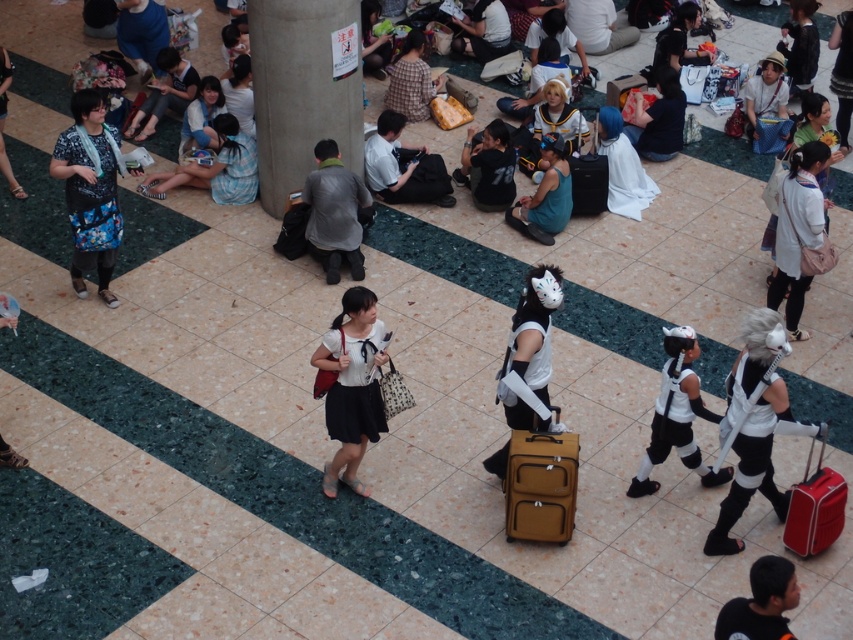
Is matte black bag at left to the left of light blue fabric dress at upper left from the viewer's perspective?

Indeed, matte black bag at left is positioned on the left side of light blue fabric dress at upper left.

Can you confirm if matte black bag at left is positioned to the right of light blue fabric dress at upper left?

In fact, matte black bag at left is to the left of light blue fabric dress at upper left.

Does point (64, 168) come farther from viewer compared to point (234, 99)?

No.

What are the coordinates of `matte black bag at left` in the screenshot? It's located at (90, 189).

Between light blue plaid dress at center and black matte shirt at center, which one appears on the right side from the viewer's perspective?

From the viewer's perspective, black matte shirt at center appears more on the right side.

Does light blue plaid dress at center appear under black matte shirt at center?

Yes, light blue plaid dress at center is below black matte shirt at center.

Where is `light blue plaid dress at center`? light blue plaid dress at center is located at coordinates (213, 168).

Identify the location of light blue plaid dress at center. Image resolution: width=853 pixels, height=640 pixels. (213, 168).

You are a GUI agent. You are given a task and a screenshot of the screen. Output one action in this format:
    pyautogui.click(x=<x>, y=<y>)
    Task: Click on the white matte shirt at center
    The height and width of the screenshot is (640, 853).
    Given the screenshot: What is the action you would take?
    pyautogui.click(x=403, y=166)

Between white matte shirt at center and white fabric bag at center, which one is positioned lower?

white matte shirt at center

Who is more forward, [431,196] or [834,44]?

Point [431,196] is more forward.

This screenshot has height=640, width=853. Find the location of `white matte shirt at center`. white matte shirt at center is located at coordinates (403, 166).